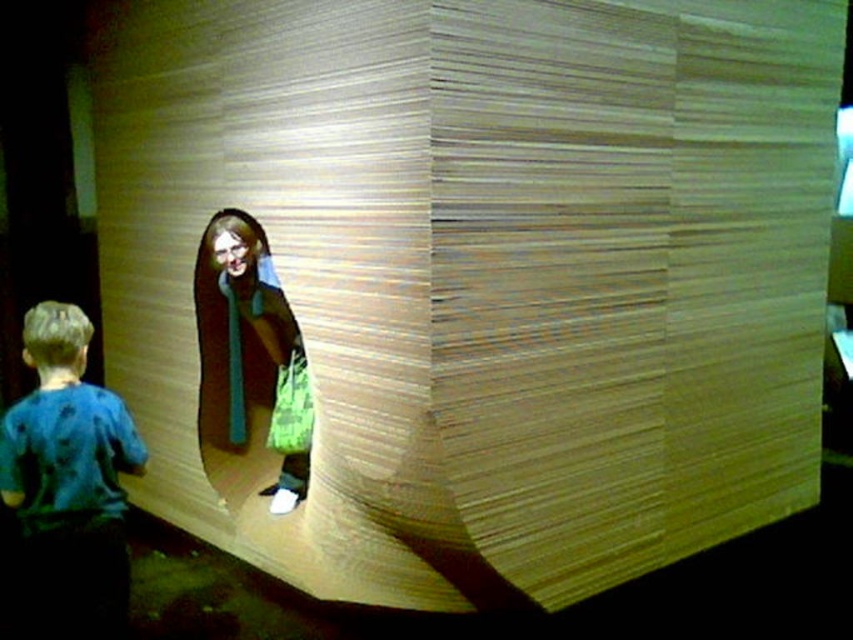
Question: Can you confirm if blue fabric shirt at lower left is wider than matte brown coat at center?

Choices:
 (A) yes
 (B) no

Answer: (B)

Question: Which of the following is the closest to the observer?

Choices:
 (A) blue fabric shirt at lower left
 (B) green fabric shopping bag at center
 (C) matte brown coat at center

Answer: (A)

Question: Among these points, which one is farthest from the camera?

Choices:
 (A) (120, 419)
 (B) (267, 346)
 (C) (291, 365)

Answer: (B)

Question: Can you confirm if matte brown coat at center is wider than green fabric shopping bag at center?

Choices:
 (A) yes
 (B) no

Answer: (A)

Question: Which is farther from the matte brown coat at center?

Choices:
 (A) green fabric shopping bag at center
 (B) blue fabric shirt at lower left

Answer: (B)

Question: Can you confirm if blue fabric shirt at lower left is positioned above green fabric shopping bag at center?

Choices:
 (A) yes
 (B) no

Answer: (B)